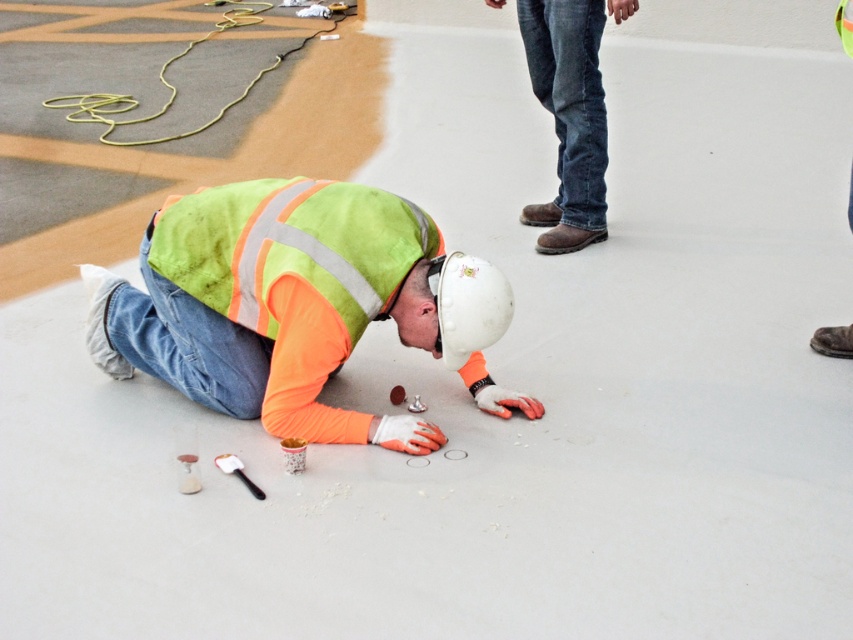
Question: Does high visibility fabric vest at center appear on the right side of jeans at upper right?

Choices:
 (A) no
 (B) yes

Answer: (A)

Question: Which point is closer to the camera?

Choices:
 (A) jeans at upper right
 (B) high visibility fabric vest at center

Answer: (B)

Question: Is high visibility fabric vest at center positioned at the back of jeans at upper right?

Choices:
 (A) yes
 (B) no

Answer: (B)

Question: Which point is farther to the camera?

Choices:
 (A) (462, 328)
 (B) (592, 193)

Answer: (B)

Question: Can you confirm if high visibility fabric vest at center is smaller than jeans at upper right?

Choices:
 (A) no
 (B) yes

Answer: (A)